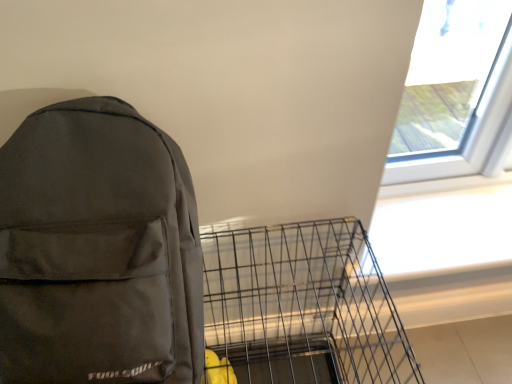
Question: Would you consider metallic wire birdcage at lower center to be distant from transparent glass window at upper right?

Choices:
 (A) yes
 (B) no

Answer: (B)

Question: Is metallic wire birdcage at lower center not inside transparent glass window at upper right?

Choices:
 (A) yes
 (B) no

Answer: (A)

Question: From the image's perspective, does metallic wire birdcage at lower center appear lower than transparent glass window at upper right?

Choices:
 (A) no
 (B) yes

Answer: (B)

Question: Can you confirm if metallic wire birdcage at lower center is shorter than transparent glass window at upper right?

Choices:
 (A) no
 (B) yes

Answer: (A)

Question: Is metallic wire birdcage at lower center turned away from transparent glass window at upper right?

Choices:
 (A) yes
 (B) no

Answer: (B)

Question: Is metallic wire birdcage at lower center positioned before transparent glass window at upper right?

Choices:
 (A) yes
 (B) no

Answer: (A)

Question: Can you confirm if matte black backpack at left is thinner than metallic wire birdcage at lower center?

Choices:
 (A) no
 (B) yes

Answer: (B)

Question: Is matte black backpack at left looking in the opposite direction of metallic wire birdcage at lower center?

Choices:
 (A) no
 (B) yes

Answer: (A)

Question: Is there a large distance between matte black backpack at left and metallic wire birdcage at lower center?

Choices:
 (A) yes
 (B) no

Answer: (B)

Question: From a real-world perspective, is matte black backpack at left positioned over metallic wire birdcage at lower center based on gravity?

Choices:
 (A) no
 (B) yes

Answer: (B)

Question: Considering the relative sizes of matte black backpack at left and metallic wire birdcage at lower center in the image provided, is matte black backpack at left shorter than metallic wire birdcage at lower center?

Choices:
 (A) no
 (B) yes

Answer: (B)

Question: Is matte black backpack at left positioned before metallic wire birdcage at lower center?

Choices:
 (A) yes
 (B) no

Answer: (A)

Question: Can you confirm if metallic wire birdcage at lower center is shorter than matte black backpack at left?

Choices:
 (A) yes
 (B) no

Answer: (B)